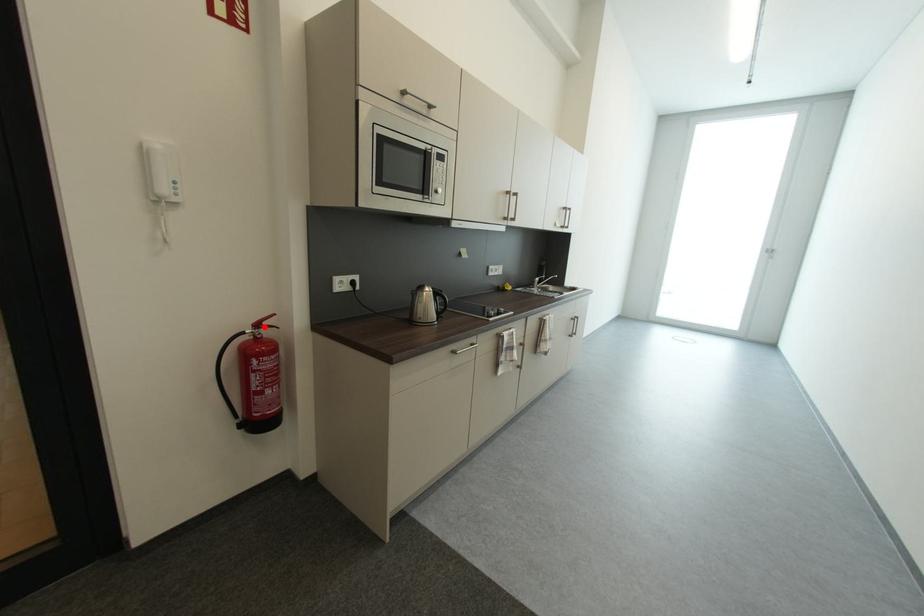
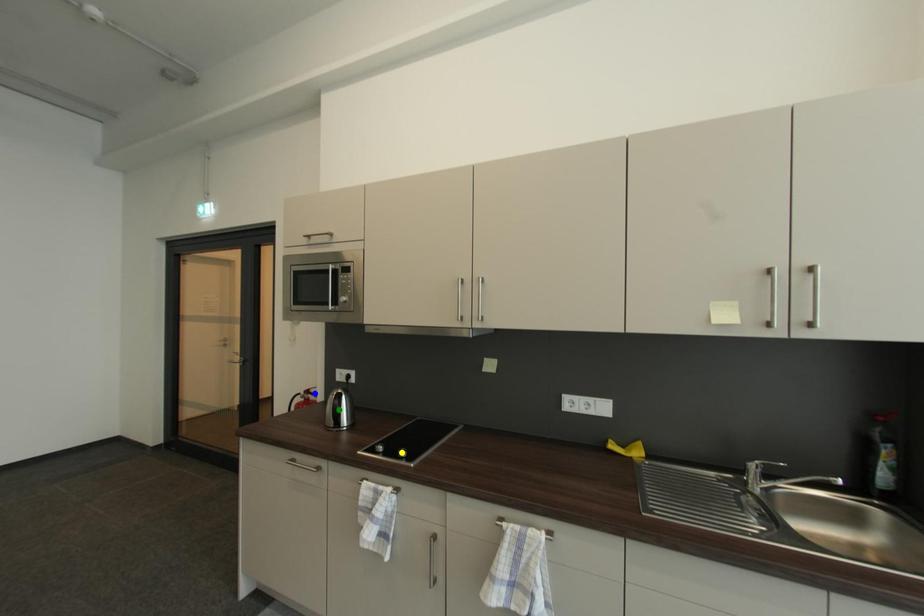
Question: I am providing you with two images of the same scene from different viewpoints. A red point is marked on the first image. You are given multiple points on the second image. Which spot in image 2 lines up with the point in image 1?

Choices:
 (A) green point
 (B) yellow point
 (C) blue point

Answer: (C)